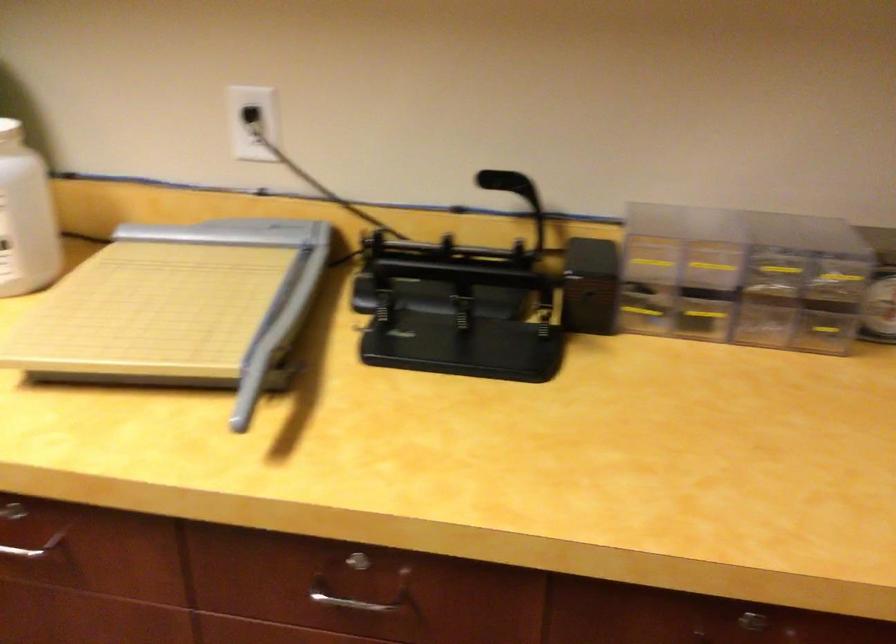
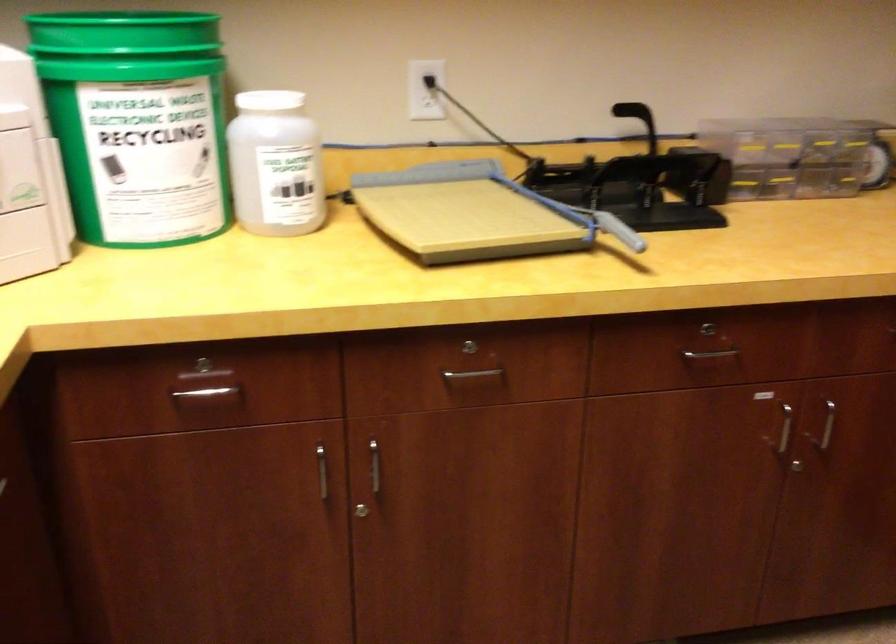
Question: The camera is either moving clockwise (left) or counter-clockwise (right) around the object. The first image is from the beginning of the video and the second image is from the end. Is the camera moving left or right when shooting the video?

Choices:
 (A) Left
 (B) Right

Answer: (A)